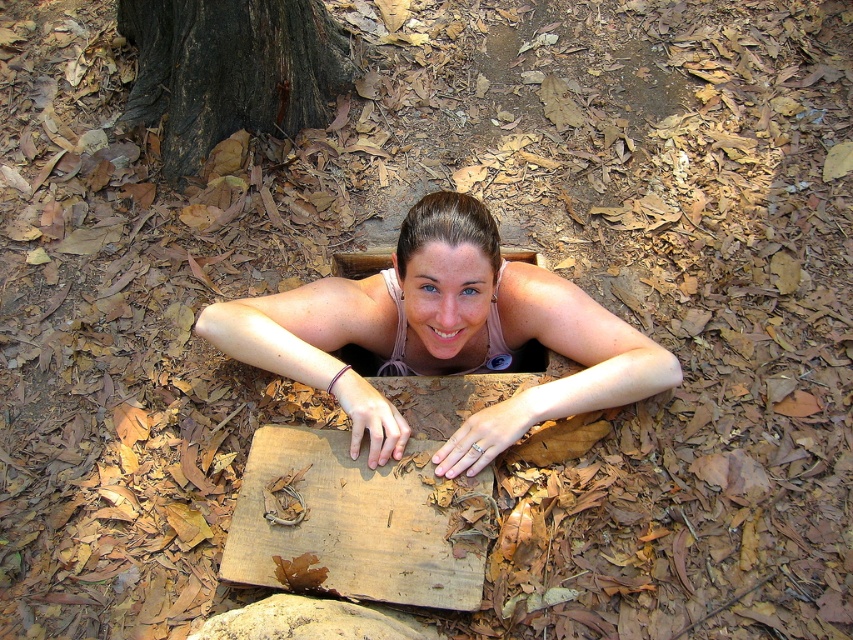
Question: Which of the following is the closest to the observer?

Choices:
 (A) brown rough bark at upper center
 (B) matte pink tank top at center
 (C) wooden plank at center

Answer: (C)

Question: Can you confirm if matte pink tank top at center is positioned to the right of brown rough bark at upper center?

Choices:
 (A) no
 (B) yes

Answer: (B)

Question: Can you confirm if matte pink tank top at center is positioned above wooden plank at center?

Choices:
 (A) no
 (B) yes

Answer: (B)

Question: Is matte pink tank top at center wider than brown rough bark at upper center?

Choices:
 (A) no
 (B) yes

Answer: (B)

Question: Estimate the real-world distances between objects in this image. Which object is farther from the matte pink tank top at center?

Choices:
 (A) wooden plank at center
 (B) brown rough bark at upper center

Answer: (B)

Question: Which of the following is the closest to the observer?

Choices:
 (A) (252, 460)
 (B) (393, 314)

Answer: (A)